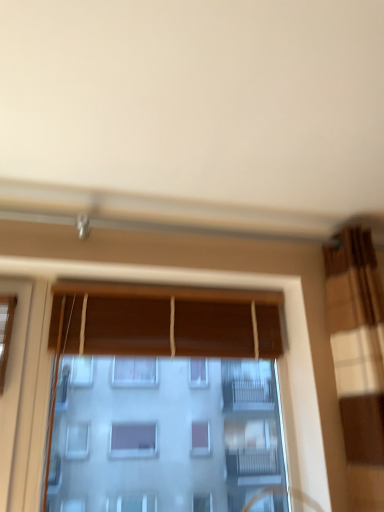
Question: Is wooden blinds at center, placed as the first curtain when sorted from left to right, smaller than wooden blinds at center?

Choices:
 (A) no
 (B) yes

Answer: (B)

Question: From a real-world perspective, does wooden blinds at center, placed as the first curtain when sorted from left to right, stand above wooden blinds at center?

Choices:
 (A) yes
 (B) no

Answer: (A)

Question: Is wooden blinds at center, the second curtain positioned from the right, closer to camera compared to wooden blinds at center?

Choices:
 (A) no
 (B) yes

Answer: (A)

Question: Is wooden blinds at center, placed as the first curtain when sorted from left to right, bigger than wooden blinds at center?

Choices:
 (A) yes
 (B) no

Answer: (B)

Question: Is wooden blinds at center at the back of wooden blinds at center, placed as the first curtain when sorted from left to right?

Choices:
 (A) no
 (B) yes

Answer: (B)

Question: From a real-world perspective, is wooden blinds at center, placed as the first curtain when sorted from left to right, beneath wooden blinds at center?

Choices:
 (A) yes
 (B) no

Answer: (B)

Question: Is brown textured curtain at right, the 1th curtain viewed from the right, taller than wooden blinds at center, the second curtain positioned from the right?

Choices:
 (A) yes
 (B) no

Answer: (A)

Question: Would you say brown textured curtain at right, arranged as the 2th curtain when viewed from the left, is outside wooden blinds at center, the second curtain positioned from the right?

Choices:
 (A) yes
 (B) no

Answer: (A)

Question: Are brown textured curtain at right, the 1th curtain viewed from the right, and wooden blinds at center, placed as the first curtain when sorted from left to right, far apart?

Choices:
 (A) no
 (B) yes

Answer: (A)

Question: From a real-world perspective, is brown textured curtain at right, arranged as the 2th curtain when viewed from the left, over wooden blinds at center, placed as the first curtain when sorted from left to right?

Choices:
 (A) no
 (B) yes

Answer: (A)

Question: From the image's perspective, is brown textured curtain at right, arranged as the 2th curtain when viewed from the left, on wooden blinds at center, placed as the first curtain when sorted from left to right?

Choices:
 (A) no
 (B) yes

Answer: (A)

Question: Is brown textured curtain at right, arranged as the 2th curtain when viewed from the left, aimed at wooden blinds at center, placed as the first curtain when sorted from left to right?

Choices:
 (A) no
 (B) yes

Answer: (A)

Question: From the image's perspective, is wooden blinds at center on top of wooden blinds at center, placed as the first curtain when sorted from left to right?

Choices:
 (A) yes
 (B) no

Answer: (B)